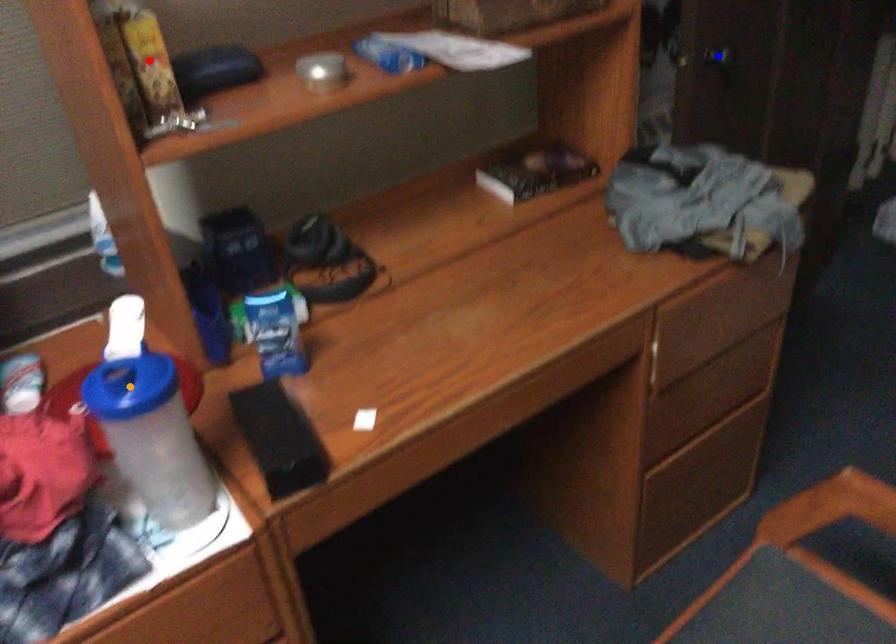
Order these from nearest to farthest:
red point
blue point
orange point

1. orange point
2. red point
3. blue point